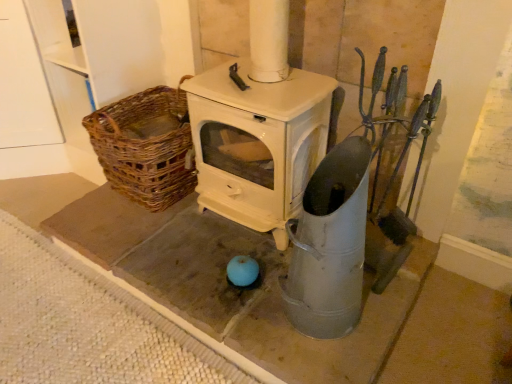
Question: In terms of width, does metallic gray bucket at center look wider or thinner when compared to woven brown basket at left?

Choices:
 (A) wide
 (B) thin

Answer: (B)

Question: From a real-world perspective, is metallic gray bucket at center physically located above or below woven brown basket at left?

Choices:
 (A) below
 (B) above

Answer: (B)

Question: Considering the positions of point (364, 228) and point (173, 140), is point (364, 228) closer or farther from the camera than point (173, 140)?

Choices:
 (A) farther
 (B) closer

Answer: (B)

Question: From a real-world perspective, is woven brown basket at left positioned above or below metallic gray bucket at center?

Choices:
 (A) above
 (B) below

Answer: (B)

Question: Considering the positions of woven brown basket at left and metallic gray bucket at center in the image, is woven brown basket at left wider or thinner than metallic gray bucket at center?

Choices:
 (A) thin
 (B) wide

Answer: (B)

Question: Is woven brown basket at left spatially inside metallic gray bucket at center, or outside of it?

Choices:
 (A) inside
 (B) outside

Answer: (B)

Question: In terms of size, does woven brown basket at left appear bigger or smaller than metallic gray bucket at center?

Choices:
 (A) big
 (B) small

Answer: (A)